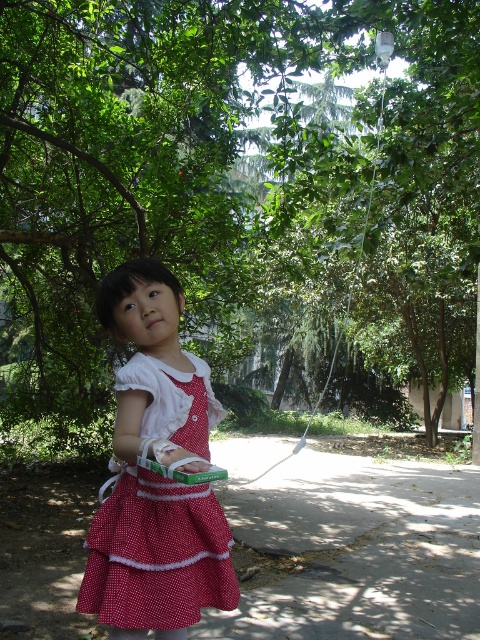
Question: Can you confirm if gray concrete pavement at lower center is wider than red polka dot dress at center?

Choices:
 (A) yes
 (B) no

Answer: (A)

Question: Can you confirm if green leafy tree at center is thinner than gray concrete pavement at lower center?

Choices:
 (A) yes
 (B) no

Answer: (B)

Question: Which point appears farthest from the camera in this image?

Choices:
 (A) (170, 532)
 (B) (357, 579)

Answer: (B)

Question: Can you confirm if gray concrete pavement at lower center is smaller than red polka dot dress at center?

Choices:
 (A) no
 (B) yes

Answer: (B)

Question: Which object is positioned farthest from the gray concrete pavement at lower center?

Choices:
 (A) red polka dot dress at center
 (B) green leafy tree at center

Answer: (B)

Question: Among these points, which one is farthest from the camera?

Choices:
 (A) (354, 564)
 (B) (154, 552)
 (C) (6, 72)

Answer: (C)